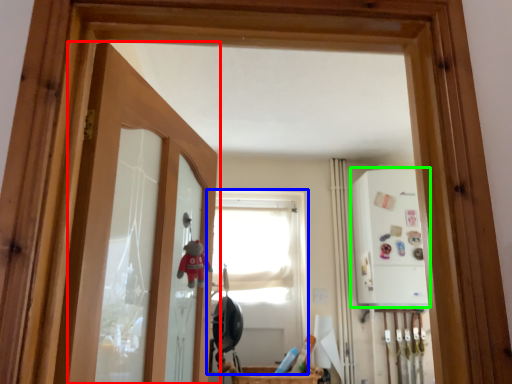
Question: Which is farther away from door (highlighted by a red box)? window (highlighted by a blue box) or medicine cabinet (highlighted by a green box)?

Choices:
 (A) window
 (B) medicine cabinet

Answer: (A)